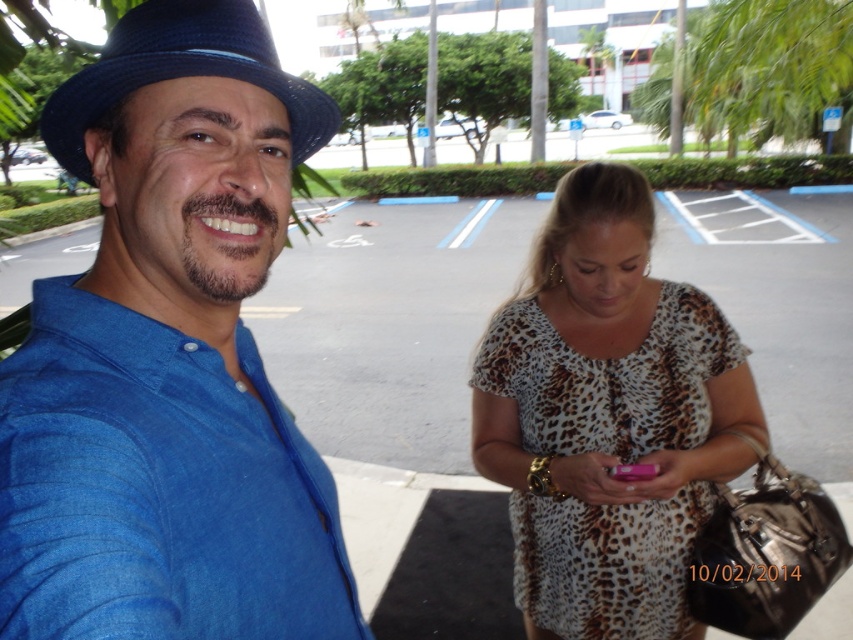
Question: Can you confirm if blue linen shirt at left is smaller than leopard print fabric dress at center?

Choices:
 (A) no
 (B) yes

Answer: (B)

Question: Is blue linen shirt at left below leopard print fabric dress at center?

Choices:
 (A) no
 (B) yes

Answer: (A)

Question: Does blue linen shirt at left have a greater width compared to blue fabric fedora at upper left?

Choices:
 (A) yes
 (B) no

Answer: (B)

Question: Estimate the real-world distances between objects in this image. Which object is farther from the blue linen shirt at left?

Choices:
 (A) blue fabric fedora at upper left
 (B) leopard print fabric dress at center

Answer: (B)

Question: Which object appears closest to the camera in this image?

Choices:
 (A) blue linen shirt at left
 (B) blue fabric fedora at upper left
 (C) leopard print fabric dress at center

Answer: (A)

Question: Which point is closer to the camera taking this photo?

Choices:
 (A) (165, 32)
 (B) (186, 292)
 (C) (711, 353)

Answer: (A)